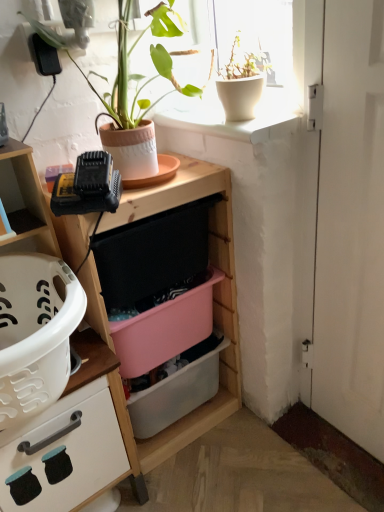
What do you see at coordinates (241, 82) in the screenshot? I see `white matte pot at upper right, which is the second houseplant in left-to-right order` at bounding box center [241, 82].

What do you see at coordinates (25, 202) in the screenshot?
I see `matte wood cabinet at left` at bounding box center [25, 202].

Where is `pink plastic storage box at center, marked as the 1th storage box in a top-to-bottom arrangement`? Image resolution: width=384 pixels, height=512 pixels. pink plastic storage box at center, marked as the 1th storage box in a top-to-bottom arrangement is located at coordinates (166, 327).

At what (x,y) coordinates should I click in order to perform the action: click on white matte pot at upper right, which is the second houseplant in left-to-right order. Please return your answer as a coordinate pair (x, y). Looking at the image, I should click on (241, 82).

Is pink plastic storage box at center, placed as the 2th storage box when sorted from bottom to top, positioned behind white matte pot at upper right, which is the second houseplant in left-to-right order?

Yes, pink plastic storage box at center, placed as the 2th storage box when sorted from bottom to top, is further from the camera.

Considering the relative sizes of pink plastic storage box at center, marked as the 1th storage box in a top-to-bottom arrangement, and white matte pot at upper right, which is the second houseplant in left-to-right order, in the image provided, is pink plastic storage box at center, marked as the 1th storage box in a top-to-bottom arrangement, bigger than white matte pot at upper right, which is the second houseplant in left-to-right order,?

Correct, pink plastic storage box at center, marked as the 1th storage box in a top-to-bottom arrangement, is larger in size than white matte pot at upper right, which is the second houseplant in left-to-right order.

Consider the image. Are pink plastic storage box at center, marked as the 1th storage box in a top-to-bottom arrangement, and white matte pot at upper right, which is the 1th houseplant in right-to-left order, beside each other?

They are not placed beside each other.

Looking at the image, does white matte door at right seem bigger or smaller compared to terracotta clay pot at upper center, the first houseplant in the left-to-right sequence?

Considering their sizes, white matte door at right takes up less space than terracotta clay pot at upper center, the first houseplant in the left-to-right sequence.

Can you confirm if white matte door at right is positioned to the right of terracotta clay pot at upper center, the first houseplant in the left-to-right sequence?

Correct, you'll find white matte door at right to the right of terracotta clay pot at upper center, the first houseplant in the left-to-right sequence.

Is white matte door at right looking in the opposite direction of terracotta clay pot at upper center, the first houseplant in the left-to-right sequence?

No, white matte door at right is not facing the opposite direction of terracotta clay pot at upper center, the first houseplant in the left-to-right sequence.

Are white matte door at right and terracotta clay pot at upper center, arranged as the 2th houseplant when viewed from the right, located far from each other?

They are positioned close to each other.

Could you tell me if wooden shelf at center is turned towards white matte door at right?

No, wooden shelf at center does not turn towards white matte door at right.

Measure the distance between wooden shelf at center and white matte door at right.

The distance of wooden shelf at center from white matte door at right is 15.53 inches.

Locate an element on the screen. This screenshot has height=512, width=384. shelf on the left of the white matte door at right is located at coordinates (x=213, y=302).

From a real-world perspective, is wooden shelf at center over white matte door at right?

Incorrect, from a real-world perspective, wooden shelf at center is lower than white matte door at right.

Would you say matte wood cabinet at left is outside pink plastic storage box at center, placed as the 2th storage box when sorted from bottom to top?

Yes, matte wood cabinet at left is located beyond the bounds of pink plastic storage box at center, placed as the 2th storage box when sorted from bottom to top.

Is pink plastic storage box at center, placed as the 2th storage box when sorted from bottom to top, at the back of matte wood cabinet at left?

No, matte wood cabinet at left's orientation is not away from pink plastic storage box at center, placed as the 2th storage box when sorted from bottom to top.

From the image's perspective, is matte wood cabinet at left located above pink plastic storage box at center, placed as the 2th storage box when sorted from bottom to top?

→ Actually, matte wood cabinet at left appears below pink plastic storage box at center, placed as the 2th storage box when sorted from bottom to top, in the image.

Measure the distance from matte wood cabinet at left to pink plastic storage box at center, marked as the 1th storage box in a top-to-bottom arrangement.

The distance of matte wood cabinet at left from pink plastic storage box at center, marked as the 1th storage box in a top-to-bottom arrangement, is 9.23 inches.

Which of these two, matte wood cabinet at left or wooden shelf at center, is bigger?

matte wood cabinet at left is bigger.

Find the location of a particular element. shelf behind the matte wood cabinet at left is located at coordinates (213, 302).

Looking at this image, which object is positioned more to the left, matte wood cabinet at left or wooden shelf at center?

Positioned to the left is matte wood cabinet at left.

What's the angular difference between white matte door at right and pink plastic storage box at center, which ranks as the 1th storage box in bottom-to-top order,'s facing directions?

89.8 degrees.

Who is smaller, white matte door at right or pink plastic storage box at center, which ranks as the 1th storage box in bottom-to-top order?

white matte door at right.

From the image's perspective, does white matte door at right appear higher than pink plastic storage box at center, which ranks as the 1th storage box in bottom-to-top order?

Yes, from the image's perspective, white matte door at right is over pink plastic storage box at center, which ranks as the 1th storage box in bottom-to-top order.

Based on the photo, is white matte door at right positioned with its back to pink plastic storage box at center, placed as the second storage box when sorted from top to bottom?

No, white matte door at right's orientation is not away from pink plastic storage box at center, placed as the second storage box when sorted from top to bottom.

Is pink plastic storage box at center, which ranks as the 1th storage box in bottom-to-top order, outside of matte wood cabinet at left?

That's correct, pink plastic storage box at center, which ranks as the 1th storage box in bottom-to-top order, is outside of matte wood cabinet at left.

Based on the photo, is pink plastic storage box at center, which ranks as the 1th storage box in bottom-to-top order, facing away from matte wood cabinet at left?

That's not correct — pink plastic storage box at center, which ranks as the 1th storage box in bottom-to-top order, is not looking away from matte wood cabinet at left.

From a real-world perspective, which is physically above, pink plastic storage box at center, which ranks as the 1th storage box in bottom-to-top order, or matte wood cabinet at left?

matte wood cabinet at left.

From the matte wood cabinet at left, count 2nd storage box to the right and point to it. Please provide its 2D coordinates.

[(178, 389)]

Locate an element on the screen. The image size is (384, 512). the 2nd storage box to the left of the white matte pot at upper right, which is the 1th houseplant in right-to-left order, starting your count from the anchor is located at coordinates (166, 327).

Find the location of a particular element. This screenshot has height=512, width=384. door that appears on the right of terracotta clay pot at upper center, arranged as the 2th houseplant when viewed from the right is located at coordinates (351, 226).

When comparing their distances from white matte pot at upper right, which is the 1th houseplant in right-to-left order, does white matte door at right or wooden shelf at center seem closer?

white matte door at right.

Based on their spatial positions, is white matte door at right or terracotta clay pot at upper center, arranged as the 2th houseplant when viewed from the right, further from pink plastic storage box at center, marked as the 1th storage box in a top-to-bottom arrangement?

Among the two, terracotta clay pot at upper center, arranged as the 2th houseplant when viewed from the right, is located further to pink plastic storage box at center, marked as the 1th storage box in a top-to-bottom arrangement.

Based on their spatial positions, is pink plastic storage box at center, which ranks as the 1th storage box in bottom-to-top order, or wooden shelf at center closer to white matte pot at upper right, which is the second houseplant in left-to-right order?

Among the two, wooden shelf at center is located nearer to white matte pot at upper right, which is the second houseplant in left-to-right order.

Estimate the real-world distances between objects in this image. Which object is further from pink plastic storage box at center, which ranks as the 1th storage box in bottom-to-top order, matte wood cabinet at left or white matte pot at upper right, which is the second houseplant in left-to-right order?

Based on the image, white matte pot at upper right, which is the second houseplant in left-to-right order, appears to be further to pink plastic storage box at center, which ranks as the 1th storage box in bottom-to-top order.

Based on the photo, estimate the real-world distances between objects in this image. Which object is further from wooden shelf at center, pink plastic storage box at center, placed as the 2th storage box when sorted from bottom to top, or white matte pot at upper right, which is the second houseplant in left-to-right order?

white matte pot at upper right, which is the second houseplant in left-to-right order.

Which object lies nearer to the anchor point matte wood cabinet at left, white matte pot at upper right, which is the 1th houseplant in right-to-left order, or terracotta clay pot at upper center, the first houseplant in the left-to-right sequence?

terracotta clay pot at upper center, the first houseplant in the left-to-right sequence, is closer to matte wood cabinet at left.

Looking at the image, which one is located closer to matte wood cabinet at left, pink plastic storage box at center, placed as the second storage box when sorted from top to bottom, or white matte door at right?

pink plastic storage box at center, placed as the second storage box when sorted from top to bottom, lies closer to matte wood cabinet at left than the other object.

Looking at the image, which one is located further to wooden shelf at center, white matte pot at upper right, which is the second houseplant in left-to-right order, or white matte door at right?

white matte pot at upper right, which is the second houseplant in left-to-right order, is further to wooden shelf at center.

Where is `shelf between matte wood cabinet at left and pink plastic storage box at center, placed as the 2th storage box when sorted from bottom to top, in the front-back direction`? This screenshot has height=512, width=384. shelf between matte wood cabinet at left and pink plastic storage box at center, placed as the 2th storage box when sorted from bottom to top, in the front-back direction is located at coordinates (213, 302).

You are a GUI agent. You are given a task and a screenshot of the screen. Output one action in this format:
    pyautogui.click(x=<x>, y=<y>)
    Task: Click on the cabinetry that lies between white matte pot at upper right, which is the second houseplant in left-to-right order, and pink plastic storage box at center, which ranks as the 1th storage box in bottom-to-top order, from top to bottom
    This screenshot has width=384, height=512.
    Given the screenshot: What is the action you would take?
    click(25, 202)

Identify the location of storage box between white matte pot at upper right, which is the 1th houseplant in right-to-left order, and matte wood cabinet at left vertically. This screenshot has width=384, height=512. pyautogui.click(x=166, y=327).

Locate an element on the screen. shelf between matte wood cabinet at left and white matte door at right from left to right is located at coordinates (213, 302).